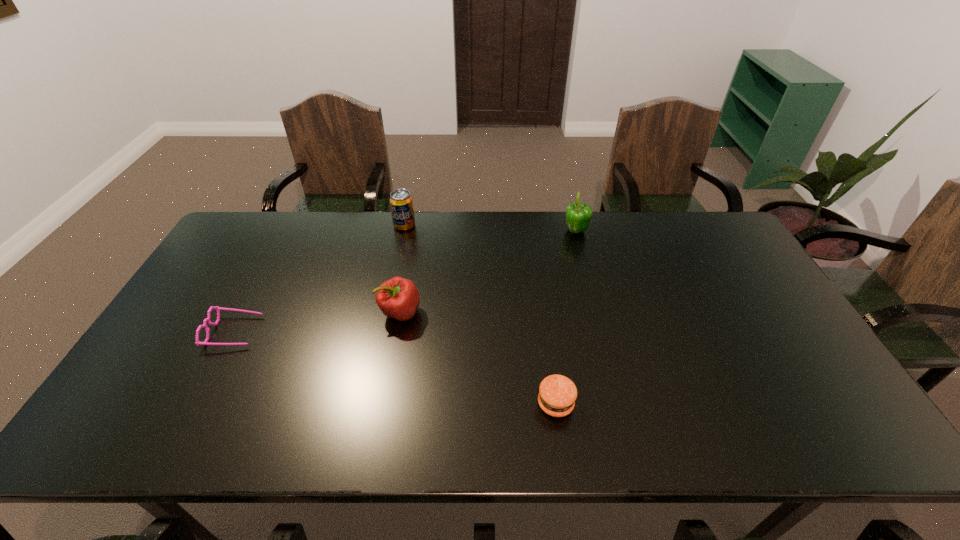
Locate an element on the screen. The width and height of the screenshot is (960, 540). free space between the soda can and the rightmost object is located at coordinates (491, 228).

Locate an element on the screen. vacant region between the farther bell pepper and the soda can is located at coordinates (491, 228).

Where is `free area in between the nearer bell pepper and the right bell pepper`? The width and height of the screenshot is (960, 540). free area in between the nearer bell pepper and the right bell pepper is located at coordinates (488, 272).

The width and height of the screenshot is (960, 540). Identify the location of free space that is in between the soda can and the nearest object. (480, 314).

The width and height of the screenshot is (960, 540). I want to click on the second closest object to the shorter bell pepper, so click(217, 308).

Identify which object is located as the second nearest to the patty. Please provide its 2D coordinates. Your answer should be formatted as a tuple, i.e. [(x, y)], where the tuple contains the x and y coordinates of a point satisfying the conditions above.

[(578, 215)]

Where is `vacant space that satisfies the following two spatial constraints: 1. on the front side of the left bell pepper; 2. on the arms of the shortest object`? This screenshot has height=540, width=960. vacant space that satisfies the following two spatial constraints: 1. on the front side of the left bell pepper; 2. on the arms of the shortest object is located at coordinates (396, 332).

Where is `vacant space that satisfies the following two spatial constraints: 1. on the front side of the soda can; 2. on the arms of the shortest object`? vacant space that satisfies the following two spatial constraints: 1. on the front side of the soda can; 2. on the arms of the shortest object is located at coordinates (382, 332).

Where is `vacant space that satisfies the following two spatial constraints: 1. on the back side of the fourth object from left to right; 2. on the arms of the shortest object`? The width and height of the screenshot is (960, 540). vacant space that satisfies the following two spatial constraints: 1. on the back side of the fourth object from left to right; 2. on the arms of the shortest object is located at coordinates (545, 332).